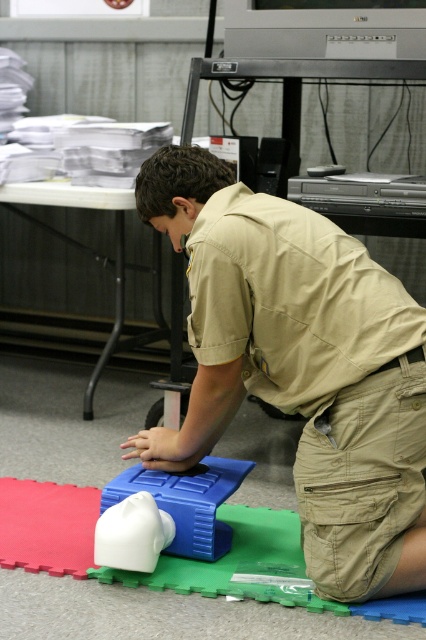
Question: Among these points, which one is farthest from the camera?

Choices:
 (A) (150, 557)
 (B) (138, 468)

Answer: (B)

Question: Where is white rubber mannequin head at lower center located in relation to white rubber toy at center in the image?

Choices:
 (A) right
 (B) left

Answer: (A)

Question: Is khaki uniform at center to the left of white rubber toy at center from the viewer's perspective?

Choices:
 (A) no
 (B) yes

Answer: (A)

Question: Which of the following is the closest to the observer?

Choices:
 (A) white rubber toy at center
 (B) white rubber mannequin head at lower center
 (C) khaki uniform at center

Answer: (C)

Question: Which object appears closest to the camera in this image?

Choices:
 (A) white rubber mannequin head at lower center
 (B) khaki uniform at center

Answer: (B)

Question: Can you confirm if khaki uniform at center is wider than white rubber toy at center?

Choices:
 (A) yes
 (B) no

Answer: (A)